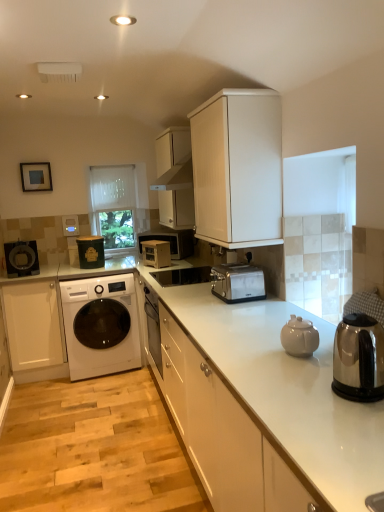
Question: Is wooden microwave at center, the first appliance in the right-to-left sequence, closer to the viewer compared to white matte cabinet at lower left, the 4th cabinetry viewed from the right?

Choices:
 (A) yes
 (B) no

Answer: (B)

Question: Is wooden microwave at center, the 3th appliance in the left-to-right sequence, shorter than white matte cabinet at lower left, marked as the first cabinetry in a left-to-right arrangement?

Choices:
 (A) yes
 (B) no

Answer: (A)

Question: Does wooden microwave at center, the 3th appliance in the left-to-right sequence, appear on the left side of white matte cabinet at lower left, marked as the first cabinetry in a left-to-right arrangement?

Choices:
 (A) no
 (B) yes

Answer: (A)

Question: Can you confirm if wooden microwave at center, the first appliance in the right-to-left sequence, is taller than white matte cabinet at lower left, marked as the first cabinetry in a left-to-right arrangement?

Choices:
 (A) yes
 (B) no

Answer: (B)

Question: Can you confirm if wooden microwave at center, the first appliance in the right-to-left sequence, is smaller than white matte cabinet at lower left, the 4th cabinetry viewed from the right?

Choices:
 (A) yes
 (B) no

Answer: (A)

Question: Is matte black coffee maker at left, acting as the 1th appliance starting from the left, in front of or behind wooden microwave at center in the image?

Choices:
 (A) front
 (B) behind

Answer: (A)

Question: Is point (16, 266) closer or farther from the camera than point (165, 236)?

Choices:
 (A) farther
 (B) closer

Answer: (B)

Question: From the image's perspective, relative to wooden microwave at center, is matte black coffee maker at left, which is counted as the 3th appliance, starting from the right, above or below?

Choices:
 (A) below
 (B) above

Answer: (A)

Question: Looking at their shapes, would you say matte black coffee maker at left, which is counted as the 3th appliance, starting from the right, is wider or thinner than wooden microwave at center?

Choices:
 (A) thin
 (B) wide

Answer: (A)

Question: Is point (226, 176) positioned closer to the camera than point (89, 266)?

Choices:
 (A) farther
 (B) closer

Answer: (B)

Question: From the image's perspective, is white textured cabinet at upper center, the 3th cabinetry from the left, positioned above or below matte green container at center-left, the second appliance in the right-to-left sequence?

Choices:
 (A) above
 (B) below

Answer: (A)

Question: Looking at the image, does white textured cabinet at upper center, arranged as the 2th cabinetry when viewed from the right, seem bigger or smaller compared to matte green container at center-left, the second appliance in the right-to-left sequence?

Choices:
 (A) big
 (B) small

Answer: (A)

Question: Considering the positions of white textured cabinet at upper center, the 3th cabinetry from the left, and matte green container at center-left, the second appliance in the right-to-left sequence, in the image, is white textured cabinet at upper center, the 3th cabinetry from the left, wider or thinner than matte green container at center-left, the second appliance in the right-to-left sequence,?

Choices:
 (A) thin
 (B) wide

Answer: (B)

Question: From their relative heights in the image, would you say matte black coffee maker at left, acting as the 1th appliance starting from the left, is taller or shorter than satin silver sink at center?

Choices:
 (A) tall
 (B) short

Answer: (A)

Question: Is matte black coffee maker at left, which is counted as the 3th appliance, starting from the right, situated inside satin silver sink at center or outside?

Choices:
 (A) outside
 (B) inside

Answer: (A)